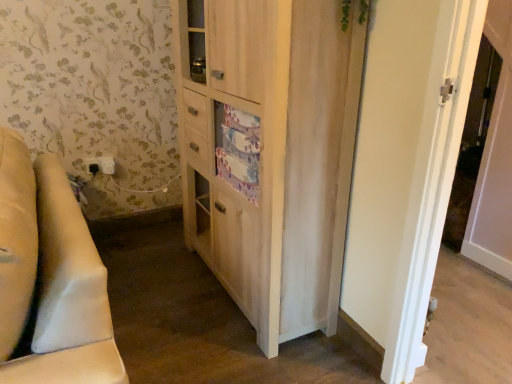
What is the approximate height of green leafy plant at upper center?

green leafy plant at upper center is 14.64 inches tall.

Describe the element at coordinates (364, 11) in the screenshot. This screenshot has height=384, width=512. I see `green leafy plant at upper center` at that location.

The height and width of the screenshot is (384, 512). Identify the location of beige fabric couch at left. (50, 277).

Image resolution: width=512 pixels, height=384 pixels. Describe the element at coordinates (269, 152) in the screenshot. I see `light wood cabinet at center` at that location.

Find the location of `light wood cabinet at center`. light wood cabinet at center is located at coordinates (269, 152).

In order to face white plastic electric outlet at lower left, should I rotate leftwards or rightwards?

To face it directly, rotate left by 20.012 degrees.

Image resolution: width=512 pixels, height=384 pixels. I want to click on green leafy plant at upper center, so click(x=364, y=11).

Is point (94, 166) more distant than point (493, 75)?

No, (94, 166) is in front of (493, 75).

Is the position of white plastic electric outlet at lower left less distant than that of white plastic screen door at upper right?

No, it is not.

Would you say white plastic screen door at upper right is part of white plastic electric outlet at lower left's contents?

No, white plastic screen door at upper right is not inside white plastic electric outlet at lower left.

Is white plastic electric outlet at lower left far away from white plastic screen door at upper right?

white plastic electric outlet at lower left is far away from white plastic screen door at upper right.

From a real-world perspective, who is located lower, beige fabric couch at left or light wood cabinet at center?

In real-world perspective, beige fabric couch at left is lower.

Does point (106, 332) appear closer or farther from the camera than point (295, 144)?

Point (106, 332) is closer to the camera than point (295, 144).

Considering the sizes of objects beige fabric couch at left and light wood cabinet at center in the image provided, who is taller, beige fabric couch at left or light wood cabinet at center?

light wood cabinet at center is taller.

Is white plastic screen door at upper right located outside white plastic electric outlet at lower left?

Indeed, white plastic screen door at upper right is completely outside white plastic electric outlet at lower left.

In order to click on screen door above the white plastic electric outlet at lower left (from a real-world perspective) in this screenshot , I will do `click(472, 143)`.

Is white plastic screen door at upper right at the right side of white plastic electric outlet at lower left?

Indeed, white plastic screen door at upper right is positioned on the right side of white plastic electric outlet at lower left.

Between beige fabric couch at left and white plastic screen door at upper right, which one appears on the left side from the viewer's perspective?

beige fabric couch at left is more to the left.

Consider the image. In the image, is beige fabric couch at left positioned in front of or behind white plastic screen door at upper right?

beige fabric couch at left is in front of white plastic screen door at upper right.

Is beige fabric couch at left not close to white plastic screen door at upper right?

Yes, beige fabric couch at left and white plastic screen door at upper right are located far from each other.

Is beige fabric couch at left oriented away from white plastic screen door at upper right?

Yes, beige fabric couch at left is positioned with its back facing white plastic screen door at upper right.

From the image's perspective, would you say white plastic screen door at upper right is shown under light wood cabinet at center?

Yes, from the image's perspective, white plastic screen door at upper right is below light wood cabinet at center.

Which of these two, white plastic screen door at upper right or light wood cabinet at center, is bigger?

light wood cabinet at center.

Looking at their sizes, would you say white plastic screen door at upper right is wider or thinner than light wood cabinet at center?

Considering their sizes, white plastic screen door at upper right looks broader than light wood cabinet at center.

Looking at this image, can light wood cabinet at center be found inside white plastic screen door at upper right?

That's incorrect, light wood cabinet at center is not inside white plastic screen door at upper right.

Based on the photo, considering the sizes of objects white plastic electric outlet at lower left and beige fabric couch at left in the image provided, who is smaller, white plastic electric outlet at lower left or beige fabric couch at left?

Smaller between the two is white plastic electric outlet at lower left.

Would you say white plastic electric outlet at lower left is to the left or to the right of beige fabric couch at left in the picture?

Clearly, white plastic electric outlet at lower left is on the left of beige fabric couch at left in the image.

Is white plastic electric outlet at lower left turned away from beige fabric couch at left?

No, white plastic electric outlet at lower left is not facing the opposite direction of beige fabric couch at left.

Is white plastic electric outlet at lower left shorter than beige fabric couch at left?

Yes, white plastic electric outlet at lower left is shorter than beige fabric couch at left.

Is green leafy plant at upper center not inside white plastic electric outlet at lower left?

Yes, green leafy plant at upper center is located beyond the bounds of white plastic electric outlet at lower left.

Image resolution: width=512 pixels, height=384 pixels. I want to click on electric outlet that is below the green leafy plant at upper center (from the image's perspective), so click(x=101, y=165).

In the scene shown: Which object is positioned more to the right, green leafy plant at upper center or white plastic electric outlet at lower left?

Positioned to the right is green leafy plant at upper center.

Is green leafy plant at upper center oriented towards white plastic electric outlet at lower left?

No, green leafy plant at upper center is not aimed at white plastic electric outlet at lower left.

Where is `screen door above the white plastic electric outlet at lower left (from the image's perspective)`? Image resolution: width=512 pixels, height=384 pixels. screen door above the white plastic electric outlet at lower left (from the image's perspective) is located at coordinates (472, 143).

Find the location of a particular element. furniture below the light wood cabinet at center (from a real-world perspective) is located at coordinates (50, 277).

From the image, which object appears to be nearer to white plastic electric outlet at lower left, beige fabric couch at left or light wood cabinet at center?

Among the two, light wood cabinet at center is located nearer to white plastic electric outlet at lower left.

Considering their positions, is beige fabric couch at left positioned closer to white plastic screen door at upper right than white plastic electric outlet at lower left?

Based on the image, beige fabric couch at left appears to be nearer to white plastic screen door at upper right.

Estimate the real-world distances between objects in this image. Which object is further from light wood cabinet at center, white plastic screen door at upper right or beige fabric couch at left?

white plastic screen door at upper right is further to light wood cabinet at center.

Based on their spatial positions, is beige fabric couch at left or light wood cabinet at center closer to green leafy plant at upper center?

Among the two, light wood cabinet at center is located nearer to green leafy plant at upper center.

Considering their positions, is beige fabric couch at left positioned closer to white plastic electric outlet at lower left than white plastic screen door at upper right?

beige fabric couch at left is closer to white plastic electric outlet at lower left.

When comparing their distances from light wood cabinet at center, does white plastic screen door at upper right or green leafy plant at upper center seem further?

Among the two, white plastic screen door at upper right is located further to light wood cabinet at center.

Based on their spatial positions, is white plastic electric outlet at lower left or green leafy plant at upper center closer to white plastic screen door at upper right?

Among the two, green leafy plant at upper center is located nearer to white plastic screen door at upper right.

When comparing their distances from beige fabric couch at left, does light wood cabinet at center or white plastic screen door at upper right seem further?

Based on the image, white plastic screen door at upper right appears to be further to beige fabric couch at left.

What are the coordinates of `cabinetry between beige fabric couch at left and white plastic electric outlet at lower left along the z-axis` in the screenshot? It's located at (269, 152).

Locate an element on the screen. cabinetry between beige fabric couch at left and white plastic screen door at upper right is located at coordinates coord(269,152).

What are the coordinates of `furniture between white plastic electric outlet at lower left and white plastic screen door at upper right from left to right` in the screenshot? It's located at (50, 277).

You are a GUI agent. You are given a task and a screenshot of the screen. Output one action in this format:
    pyautogui.click(x=<x>, y=<y>)
    Task: Click on the plant between beige fabric couch at left and white plastic electric outlet at lower left from front to back
    The width and height of the screenshot is (512, 384).
    Given the screenshot: What is the action you would take?
    pyautogui.click(x=364, y=11)